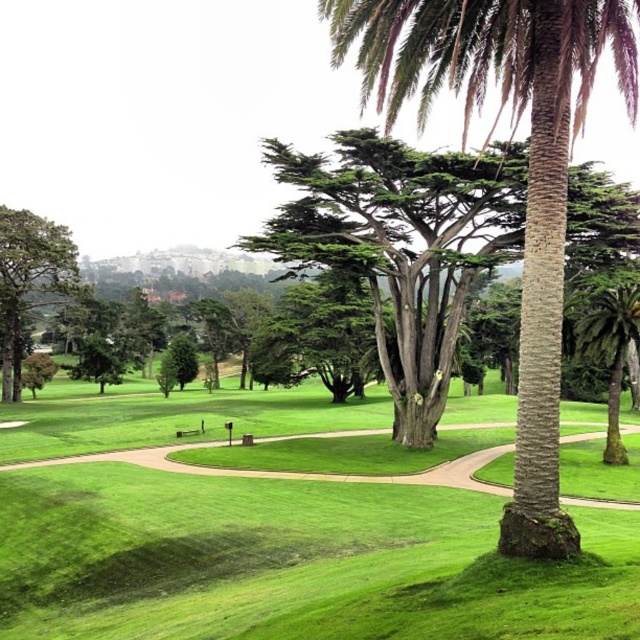
You are a gardener planning to place a new bench between the green matte tree at left and the green mossy palm tree at right. Based on their widths, which tree requires more space around it for proper growth?

The green matte tree at left might be wider than the green mossy palm tree at right, so it requires more space around it for proper growth.

You are standing at the camera position in the park and want to take a photo of the green textured palm tree at center. The camera has a focal length of 50mm. To capture the entire palm tree in the frame, you need to be at least 25 feet away. Can you take the photo without moving closer?

The green textured palm tree at center is 24.94 feet away from the camera, which is just under the required 25 feet. Therefore, you cannot take the photo without moving closer to ensure the entire tree fits in the frame.